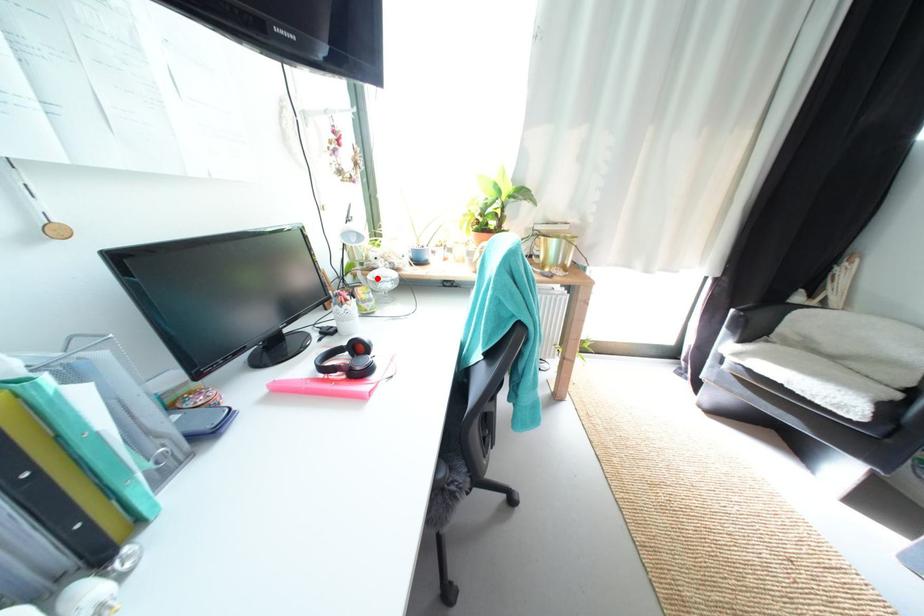
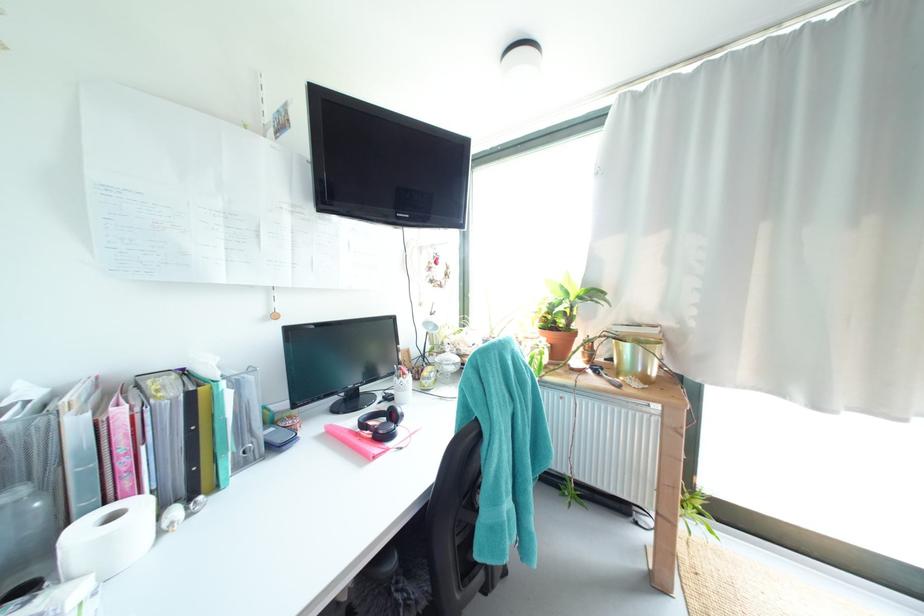
The point at the highlighted location is marked in the first image. Where is the corresponding point in the second image?

(445, 361)